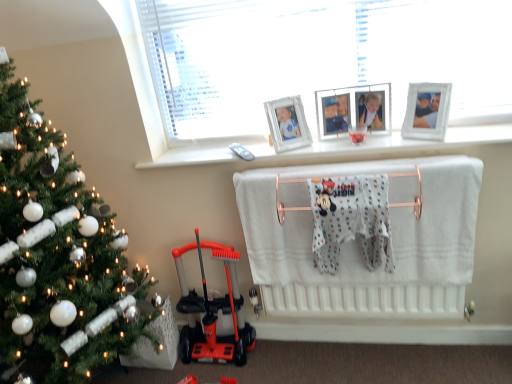
Question: Is point (70, 188) positioned closer to the camera than point (329, 127)?

Choices:
 (A) closer
 (B) farther

Answer: (A)

Question: Which is correct: green matte christmas tree at left is inside white wooden picture frame at upper center, which is counted as the 2th picture frame, starting from the right, or outside of it?

Choices:
 (A) inside
 (B) outside

Answer: (B)

Question: Based on their relative distances, which object is nearer to the white glass window at upper center?

Choices:
 (A) white fabric infant bed at center
 (B) orange plastic scooter at lower left
 (C) white glossy picture frame at upper right, which appears as the first picture frame when viewed from the right
 (D) white wooden picture frame at upper center, the first picture frame from the left
 (E) white cotton bath towel at center

Answer: (D)

Question: Which of these objects is positioned farthest from the white glossy picture frame at upper right, which ranks as the 2th picture frame in left-to-right order?

Choices:
 (A) white wooden picture frame at upper center, the first picture frame from the left
 (B) green matte christmas tree at left
 (C) white fabric infant bed at center
 (D) white glass window at upper center
 (E) white cotton bath towel at center

Answer: (B)